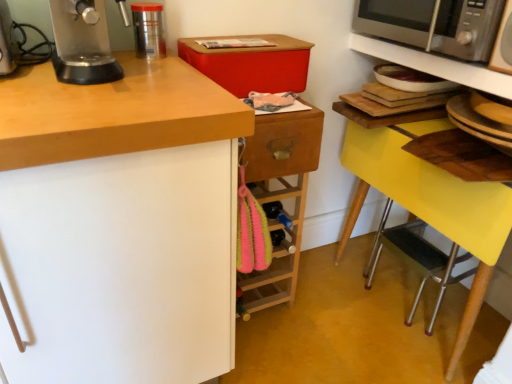
This screenshot has width=512, height=384. What do you see at coordinates (434, 25) in the screenshot?
I see `satin silver microwave at upper right` at bounding box center [434, 25].

The height and width of the screenshot is (384, 512). I want to click on satin silver microwave at upper right, so click(x=434, y=25).

The width and height of the screenshot is (512, 384). What do you see at coordinates (148, 30) in the screenshot?
I see `metallic cylindrical container at upper left` at bounding box center [148, 30].

This screenshot has height=384, width=512. I want to click on yellow plastic step stool at lower right, so click(417, 259).

The width and height of the screenshot is (512, 384). Describe the element at coordinates (435, 65) in the screenshot. I see `metallic silver microwave at upper right` at that location.

Identify the location of satin silver microwave at upper right. The width and height of the screenshot is (512, 384). (434, 25).

Would you consider satin silver microwave at upper right to be distant from satin silver microwave at upper right?

That's not correct — satin silver microwave at upper right is a little close to satin silver microwave at upper right.

Based on the photo, from a real-world perspective, is satin silver microwave at upper right positioned above or below satin silver microwave at upper right?

From a real-world perspective, satin silver microwave at upper right is physically above satin silver microwave at upper right.

From the image's perspective, which is above, satin silver microwave at upper right or satin silver microwave at upper right?

From the image's view, satin silver microwave at upper right is above.

Where is `appliance in front of the satin silver microwave at upper right`? This screenshot has width=512, height=384. appliance in front of the satin silver microwave at upper right is located at coordinates click(x=503, y=44).

Is wooden drawer at center taller than metallic silver microwave at upper right?

Yes, wooden drawer at center is taller than metallic silver microwave at upper right.

Is wooden drawer at center in front of or behind metallic silver microwave at upper right in the image?

In the image, wooden drawer at center appears behind metallic silver microwave at upper right.

From the picture: Who is smaller, wooden drawer at center or metallic silver microwave at upper right?

With smaller size is wooden drawer at center.

In order to click on microwave oven in front of the metallic cylindrical container at upper left in this screenshot , I will do `click(434, 25)`.

From their relative heights in the image, would you say satin silver microwave at upper right is taller or shorter than metallic cylindrical container at upper left?

satin silver microwave at upper right is taller than metallic cylindrical container at upper left.

Who is smaller, satin silver microwave at upper right or metallic cylindrical container at upper left?

Smaller between the two is metallic cylindrical container at upper left.

What's the angular difference between satin silver microwave at upper right and metallic cylindrical container at upper left's facing directions?

The facing directions of satin silver microwave at upper right and metallic cylindrical container at upper left are 85.8 degrees apart.

Which is further, (369,53) or (277,123)?

Point (369,53)

Looking at this image, is metallic silver microwave at upper right positioned in front of wooden drawer at center?

Yes, metallic silver microwave at upper right is closer to the viewer.

From a real-world perspective, does metallic silver microwave at upper right stand above wooden drawer at center?

Yes.

Based on the photo, is metallic silver microwave at upper right looking in the opposite direction of wooden drawer at center?

No, wooden drawer at center is not at the back of metallic silver microwave at upper right.

Is the surface of satin silver microwave at upper right in direct contact with transparent plastic coffee maker at left?

No.

Looking at this image, do you think satin silver microwave at upper right is within transparent plastic coffee maker at left, or outside of it?

satin silver microwave at upper right is not inside transparent plastic coffee maker at left, it's outside.

Can you confirm if satin silver microwave at upper right is wider than transparent plastic coffee maker at left?

Indeed, satin silver microwave at upper right has a greater width compared to transparent plastic coffee maker at left.

Who is shorter, satin silver microwave at upper right or transparent plastic coffee maker at left?

satin silver microwave at upper right is shorter.

Would you say wooden drawer at center is to the left or to the right of metallic cylindrical container at upper left in the picture?

Based on their positions, wooden drawer at center is located to the right of metallic cylindrical container at upper left.

Is wooden drawer at center positioned far away from metallic cylindrical container at upper left?

No.

Who is smaller, wooden drawer at center or metallic cylindrical container at upper left?

With smaller size is metallic cylindrical container at upper left.

Does wooden drawer at center turn towards metallic cylindrical container at upper left?

No, wooden drawer at center is not facing towards metallic cylindrical container at upper left.

Between transparent plastic coffee maker at left and satin silver microwave at upper right, which one appears on the right side from the viewer's perspective?

satin silver microwave at upper right.

Between transparent plastic coffee maker at left and satin silver microwave at upper right, which one is positioned in front?

transparent plastic coffee maker at left.

From the image's perspective, relative to satin silver microwave at upper right, is transparent plastic coffee maker at left above or below?

transparent plastic coffee maker at left is situated lower than satin silver microwave at upper right in the image.

How many degrees apart are the facing directions of transparent plastic coffee maker at left and satin silver microwave at upper right?

The angle between the facing direction of transparent plastic coffee maker at left and the facing direction of satin silver microwave at upper right is 89.6 degrees.

You are a GUI agent. You are given a task and a screenshot of the screen. Output one action in this format:
    pyautogui.click(x=<x>, y=<y>)
    Task: Click on the microwave oven behind the satin silver microwave at upper right
    This screenshot has width=512, height=384.
    Given the screenshot: What is the action you would take?
    pyautogui.click(x=434, y=25)

Where is `drawer lying below the metallic silver microwave at upper right (from the image's perspective)`? drawer lying below the metallic silver microwave at upper right (from the image's perspective) is located at coordinates (283, 145).

Which object lies nearer to the anchor point metallic silver microwave at upper right, satin silver microwave at upper right or transparent plastic coffee maker at left?

The object closer to metallic silver microwave at upper right is satin silver microwave at upper right.

When comparing their distances from satin silver microwave at upper right, does satin silver microwave at upper right or transparent plastic coffee maker at left seem further?

transparent plastic coffee maker at left.

Based on their spatial positions, is yellow wood table at lower right or satin silver microwave at upper right closer to wooden drawer at center?

yellow wood table at lower right lies closer to wooden drawer at center than the other object.

Which object lies further to the anchor point wooden drawer at center, metallic cylindrical container at upper left or satin silver microwave at upper right?

satin silver microwave at upper right.

Based on their spatial positions, is yellow plastic step stool at lower right or wooden drawer at center closer to transparent plastic coffee maker at left?

Based on the image, wooden drawer at center appears to be nearer to transparent plastic coffee maker at left.

Considering their positions, is metallic silver microwave at upper right positioned further to satin silver microwave at upper right than transparent plastic coffee maker at left?

transparent plastic coffee maker at left.

From the image, which object appears to be farther from wooden drawer at center, satin silver microwave at upper right or metallic silver microwave at upper right?

satin silver microwave at upper right lies further to wooden drawer at center than the other object.

Considering their positions, is yellow plastic step stool at lower right positioned closer to satin silver microwave at upper right than transparent plastic coffee maker at left?

yellow plastic step stool at lower right lies closer to satin silver microwave at upper right than the other object.

Where is `table between transparent plastic coffee maker at left and yellow plastic step stool at lower right in the horizontal direction`? This screenshot has height=384, width=512. table between transparent plastic coffee maker at left and yellow plastic step stool at lower right in the horizontal direction is located at coordinates (462, 156).

You are a GUI agent. You are given a task and a screenshot of the screen. Output one action in this format:
    pyautogui.click(x=<x>, y=<y>)
    Task: Click on the shelf located between metallic cylindrical container at upper left and yellow plastic step stool at lower right in the left-right direction
    This screenshot has width=512, height=384.
    Given the screenshot: What is the action you would take?
    pyautogui.click(x=435, y=65)

This screenshot has width=512, height=384. I want to click on table located between metallic cylindrical container at upper left and yellow plastic step stool at lower right in the left-right direction, so click(x=462, y=156).

What are the coordinates of `table between satin silver microwave at upper right and yellow plastic step stool at lower right from front to back` in the screenshot? It's located at (462, 156).